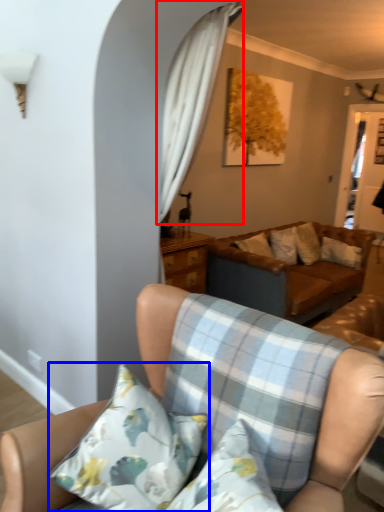
Question: Among these objects, which one is farthest to the camera, curtain (highlighted by a red box) or pillow (highlighted by a blue box)?

Choices:
 (A) curtain
 (B) pillow

Answer: (A)